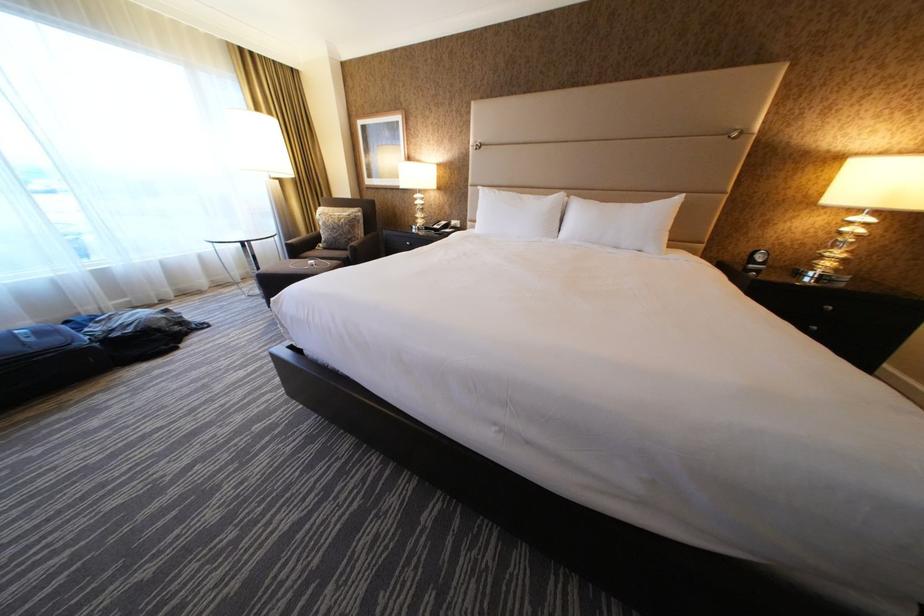
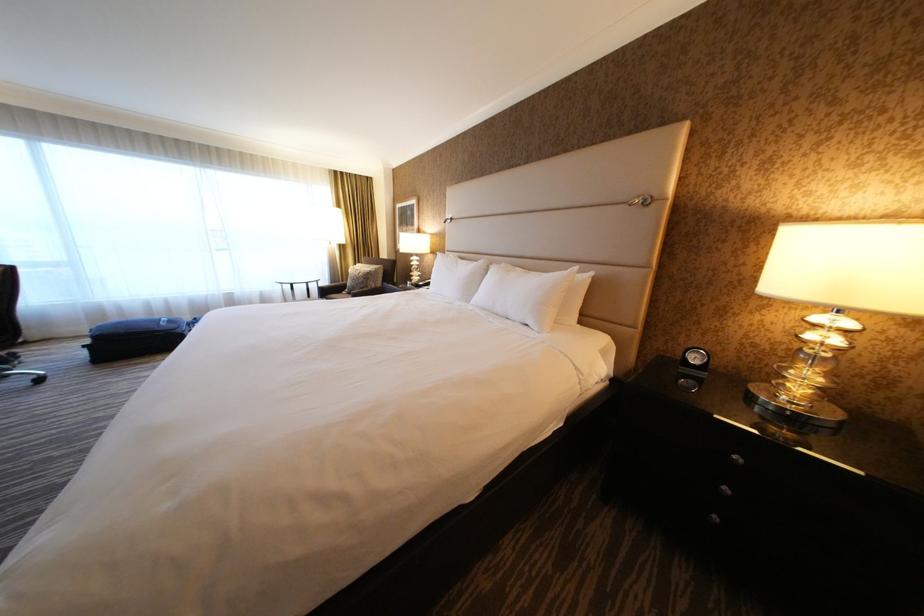
Question: In a continuous first-person perspective shot, in which direction is the camera moving?

Choices:
 (A) Left
 (B) Right
 (C) Forward
 (D) Backward

Answer: (B)